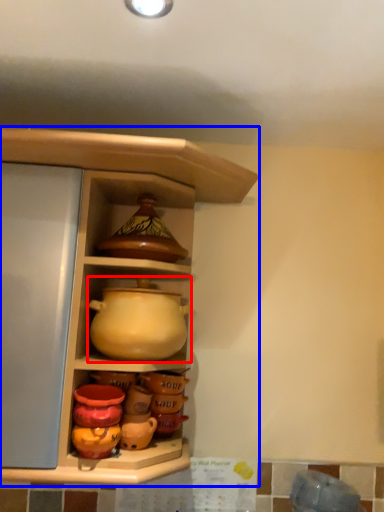
Question: Among these objects, which one is farthest to the camera, jug (highlighted by a red box) or shelf (highlighted by a blue box)?

Choices:
 (A) jug
 (B) shelf

Answer: (A)